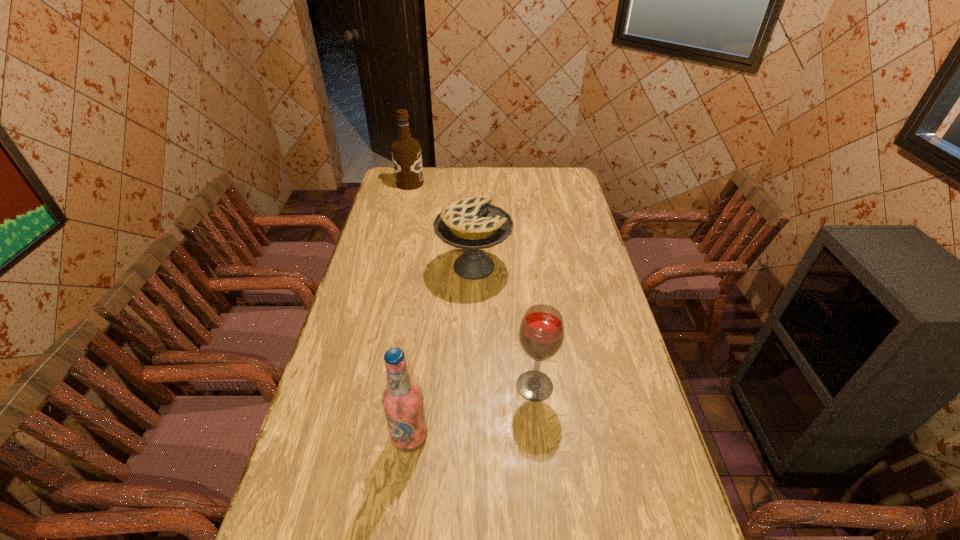
Find the location of a particular element. This screenshot has height=540, width=960. vacant space located on the cut side of the third nearest object is located at coordinates (571, 267).

Image resolution: width=960 pixels, height=540 pixels. I want to click on object that is positioned at the far edge, so click(406, 153).

Find the location of a particular element. object that is at the left edge is located at coordinates (406, 153).

You are a GUI agent. You are given a task and a screenshot of the screen. Output one action in this format:
    pyautogui.click(x=<x>, y=<y>)
    Task: Click on the object situated at the far left corner
    
    Given the screenshot: What is the action you would take?
    [406, 153]

In order to click on vacant space at the far edge of the desktop in this screenshot , I will do `click(497, 167)`.

I want to click on vacant region at the left edge of the desktop, so click(x=374, y=230).

In the image, there is a desktop. At what (x,y) coordinates should I click in order to perform the action: click on vacant region at the right edge. Please return your answer as a coordinate pair (x, y). Looking at the image, I should click on (584, 252).

Where is `free space at the far right corner of the desktop`? This screenshot has width=960, height=540. free space at the far right corner of the desktop is located at coordinates (559, 190).

Identify the location of free space that is in between the second farthest object and the nearest alcohol. (442, 352).

Locate an element on the screen. free space between the nearest alcohol and the farthest alcohol is located at coordinates (410, 310).